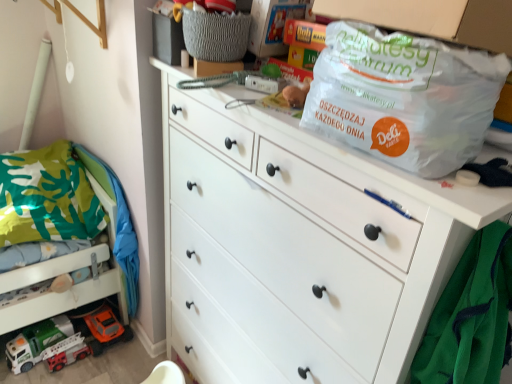
Question: Is green fabric bunk bed at lower left smaller than gray woven basket at upper center?

Choices:
 (A) yes
 (B) no

Answer: (B)

Question: Is green fabric bunk bed at lower left with gray woven basket at upper center?

Choices:
 (A) no
 (B) yes

Answer: (A)

Question: Is green fabric bunk bed at lower left positioned far away from gray woven basket at upper center?

Choices:
 (A) no
 (B) yes

Answer: (B)

Question: Considering the relative sizes of green fabric bunk bed at lower left and gray woven basket at upper center in the image provided, is green fabric bunk bed at lower left bigger than gray woven basket at upper center?

Choices:
 (A) no
 (B) yes

Answer: (B)

Question: Could you tell me if green fabric bunk bed at lower left is turned towards gray woven basket at upper center?

Choices:
 (A) no
 (B) yes

Answer: (A)

Question: Considering the relative sizes of green fabric bunk bed at lower left and gray woven basket at upper center in the image provided, is green fabric bunk bed at lower left taller than gray woven basket at upper center?

Choices:
 (A) no
 (B) yes

Answer: (B)

Question: Are gray woven basket at upper center and transparent plastic bag at upper right making contact?

Choices:
 (A) yes
 (B) no

Answer: (B)

Question: Does gray woven basket at upper center have a larger size compared to transparent plastic bag at upper right?

Choices:
 (A) yes
 (B) no

Answer: (B)

Question: Can you confirm if gray woven basket at upper center is thinner than transparent plastic bag at upper right?

Choices:
 (A) yes
 (B) no

Answer: (A)

Question: Is transparent plastic bag at upper right inside gray woven basket at upper center?

Choices:
 (A) yes
 (B) no

Answer: (B)

Question: Does gray woven basket at upper center appear on the left side of transparent plastic bag at upper right?

Choices:
 (A) no
 (B) yes

Answer: (B)

Question: Is gray woven basket at upper center positioned behind transparent plastic bag at upper right?

Choices:
 (A) yes
 (B) no

Answer: (A)

Question: Does transparent plastic bag at upper right touch white matte chest of drawers at center?

Choices:
 (A) yes
 (B) no

Answer: (B)